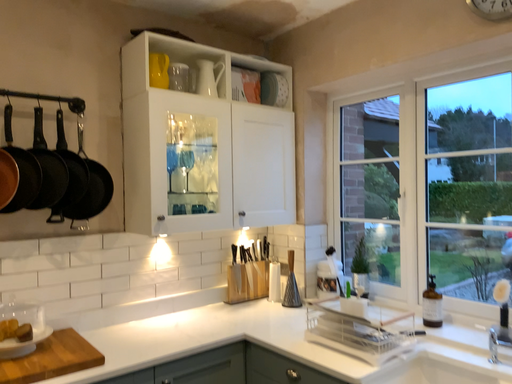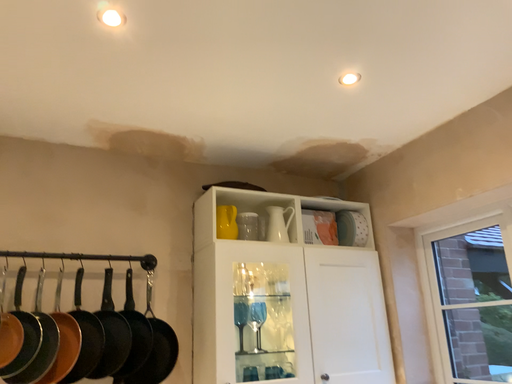
Question: Which way did the camera rotate in the video?

Choices:
 (A) rotated upward
 (B) rotated downward

Answer: (A)